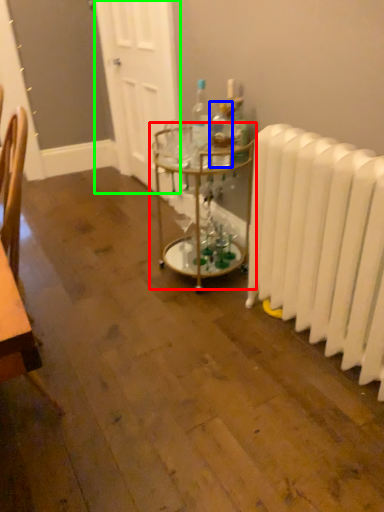
Question: Which object is positioned farthest from table (highlighted by a red box)? Select from bottle (highlighted by a blue box) and door (highlighted by a green box).

Choices:
 (A) bottle
 (B) door

Answer: (B)